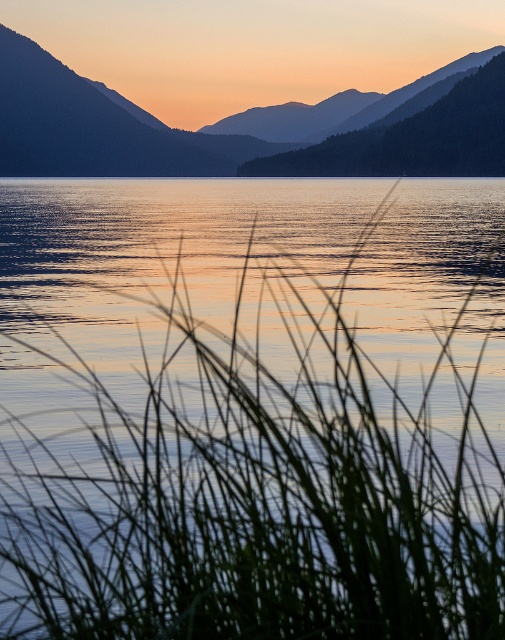
You are a photographer standing at the edge of the water. You want to take a photo that includes both the green grass at center and the silvery metallic mountain at upper left. Based on their positions, which object will appear closer to you in the photo?

The green grass at center will appear closer to you in the photo because it is positioned in front of the silvery metallic mountain at upper left.

You are standing at the edge of the water and see the green grass at center and the silvery metallic mountain at upper left. Which object is closer to you?

The green grass at center is closer to you because it is located below the silvery metallic mountain at upper left, indicating it is in the foreground.

You are standing in the serene landscape and want to take a photo of the green grass at center and the silvery metallic mountain at upper left. Based on their positions, which object should you frame first in your camera viewfinder to ensure both are in the shot?

You should frame the silvery metallic mountain at upper left first because the green grass at center is to the right of it, so positioning the mountain first ensures the grass will be included to its right in the frame.